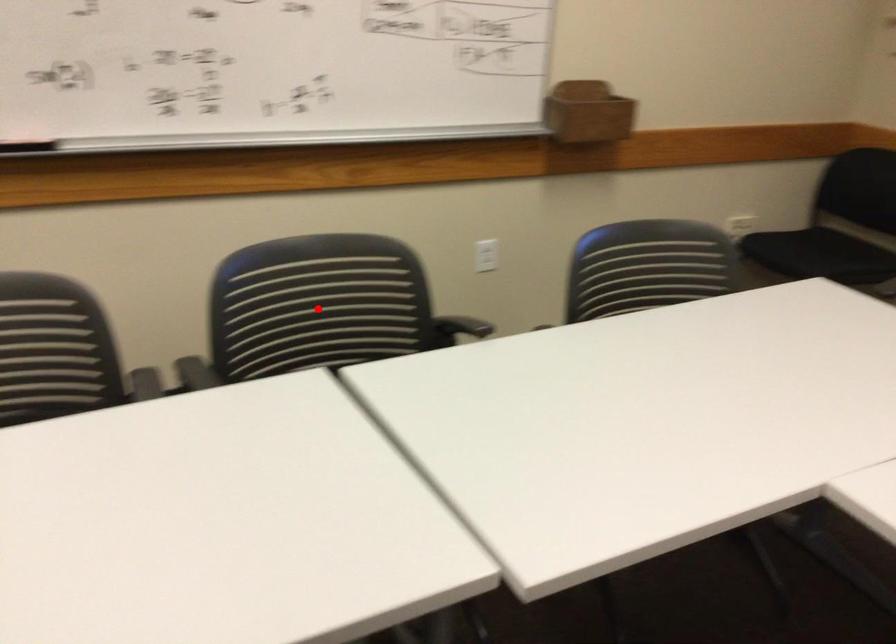
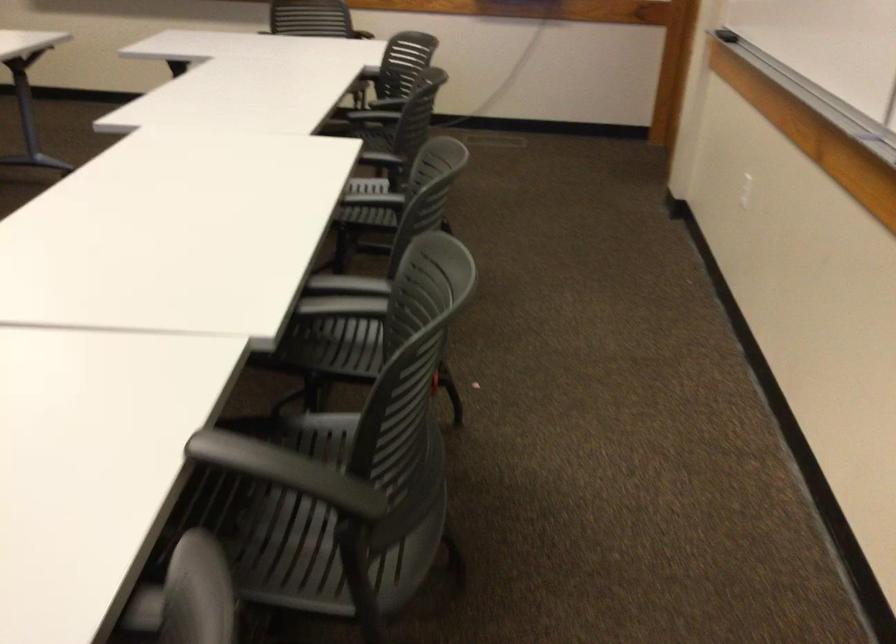
Question: I am providing you with two images of the same scene from different viewpoints. A red point is marked on the first image. Is the red point's position out of view in image 2?

Choices:
 (A) Yes
 (B) No

Answer: (A)